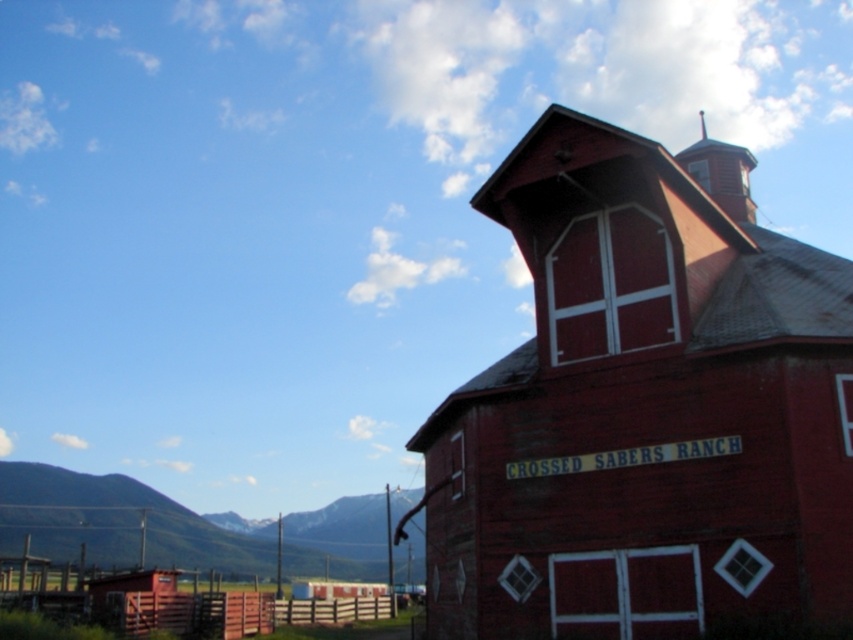
Question: Can you confirm if green grassy hill at lower left is smaller than metallic spire at upper center?

Choices:
 (A) no
 (B) yes

Answer: (B)

Question: Considering the real-world distances, which object is closest to the rustic wood barn tower at upper right?

Choices:
 (A) green grassy hill at lower left
 (B) metallic spire at upper center

Answer: (B)

Question: Observing the image, what is the correct spatial positioning of rustic wood barn tower at upper right in reference to metallic spire at upper center?

Choices:
 (A) right
 (B) left

Answer: (B)

Question: Is rustic wood barn tower at upper right to the right of green grassy hill at lower left from the viewer's perspective?

Choices:
 (A) no
 (B) yes

Answer: (B)

Question: Based on their relative distances, which object is nearer to the metallic spire at upper center?

Choices:
 (A) green grassy hill at lower left
 (B) rustic wood barn tower at upper right

Answer: (B)

Question: Which object is positioned closest to the metallic spire at upper center?

Choices:
 (A) rustic wood barn tower at upper right
 (B) green grassy hill at lower left

Answer: (A)